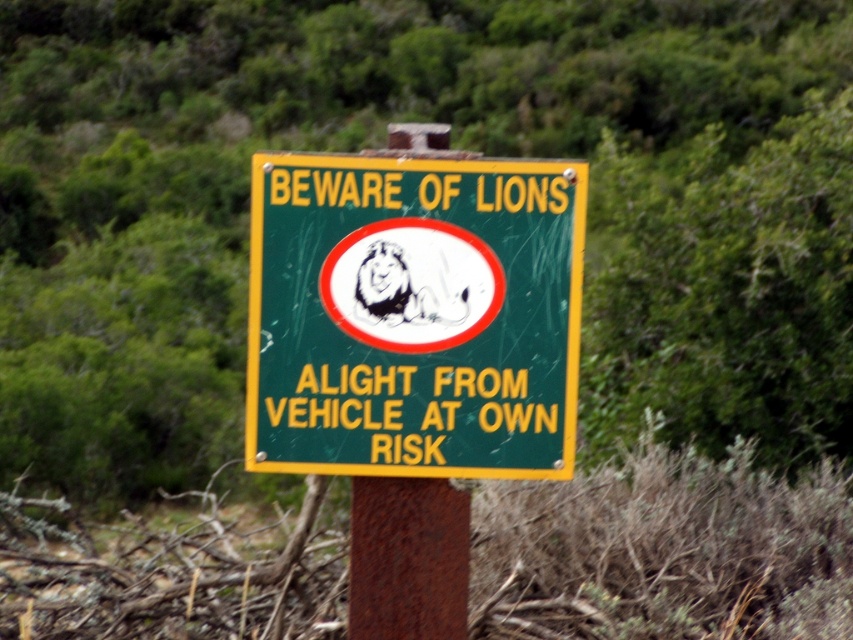
You are standing at the point with coordinates point [407,557]. What object are you standing on?

You are standing on the rusty metal pole at center, which corresponds to the point [407,557].

You are driving through a safari area and see the green matte sign at center and the rusty metal pole at center. According to the sign, what should you avoid doing?

The sign states that you should avoid alighting from your vehicle, as the text says, ALIGHT FROM VEHICLE AT OWN RISK, indicating potential danger if you get out.

You are a park ranger inspecting the warning sign in the image. You notice two objects labeled as the rusty metal pole at center and the rusty metal post at center. Which object is positioned lower in the scene?

The rusty metal pole at center is located below the rusty metal post at center, so it is positioned lower in the scene.